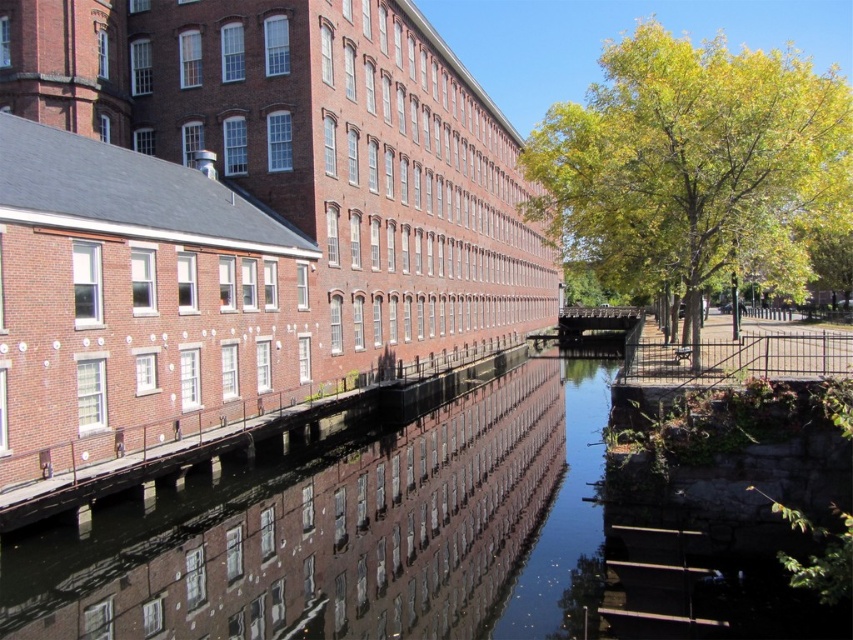
Which is more to the right, smooth concrete river at center or green leafy tree at right?

Positioned to the right is green leafy tree at right.

Measure the distance between smooth concrete river at center and green leafy tree at right.

smooth concrete river at center and green leafy tree at right are 157.06 feet apart from each other.

Is point (289, 548) in front of point (614, 268)?

Yes, it is in front of point (614, 268).

This screenshot has height=640, width=853. In order to click on smooth concrete river at center in this screenshot , I will do tap(358, 536).